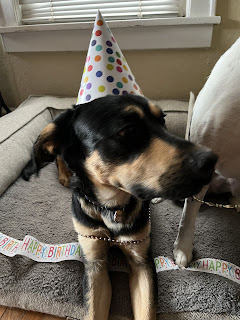
Find the location of a particular element. The width and height of the screenshot is (240, 320). dog bed is located at coordinates (43, 223), (216, 233), (174, 127).